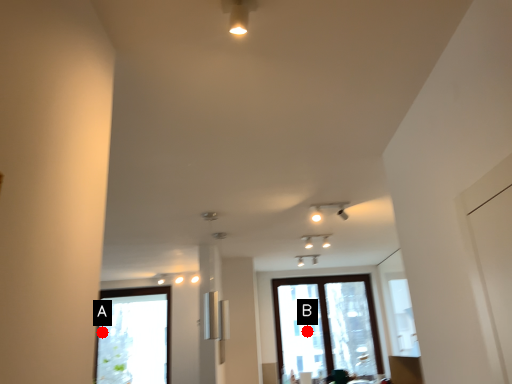
Question: Two points are circled on the image, labeled by A and B beside each circle. Which point is closer to the camera?

Choices:
 (A) A is closer
 (B) B is closer

Answer: (A)